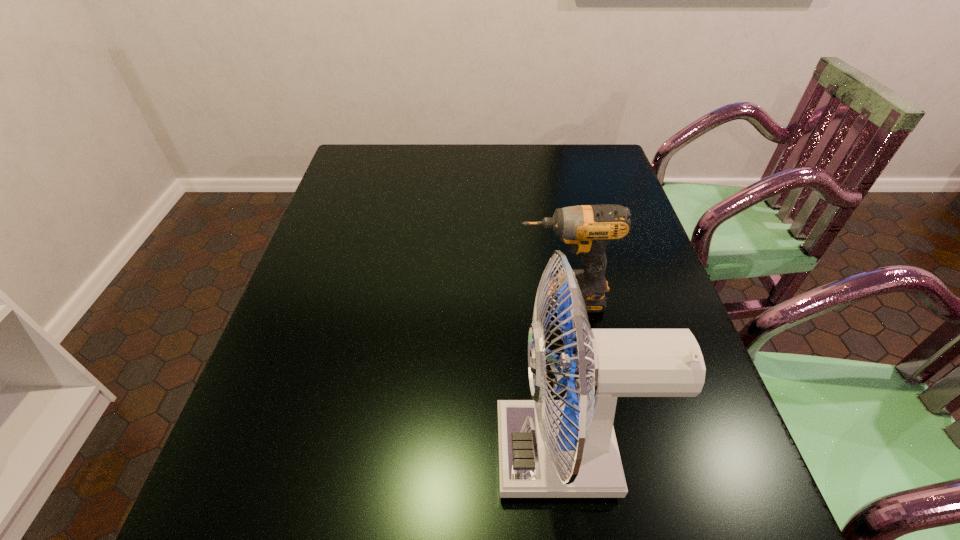
I want to click on the shorter object, so click(587, 229).

I want to click on drill, so click(587, 229).

Locate an element on the screen. The image size is (960, 540). vacant point located with the drill bit of the shorter object facing forward is located at coordinates (355, 299).

Locate an element on the screen. free space located 0.350m with the drill bit of the shorter object facing forward is located at coordinates (372, 299).

I want to click on vacant space located with the drill bit of the shorter object facing forward, so click(438, 299).

Locate an element on the screen. The height and width of the screenshot is (540, 960). object that is positioned at the right edge is located at coordinates (587, 229).

In the image, there is a desktop. Identify the location of free space at the far edge. [x=532, y=165].

Locate an element on the screen. vacant point at the left edge is located at coordinates (311, 302).

The image size is (960, 540). I want to click on vacant position at the right edge of the desktop, so click(633, 266).

Where is `blank space at the far left corner of the desktop`? The height and width of the screenshot is (540, 960). blank space at the far left corner of the desktop is located at coordinates (348, 158).